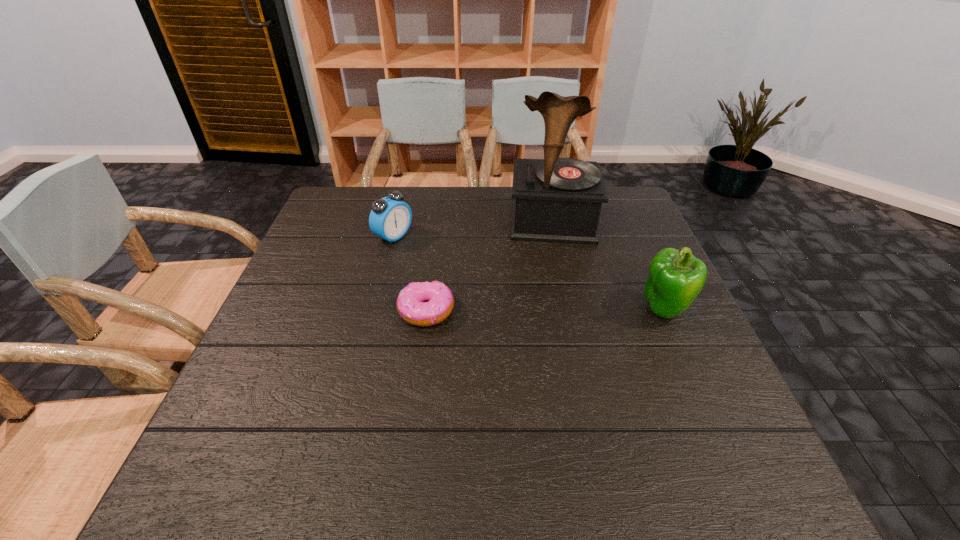
This screenshot has width=960, height=540. Find the location of `free space between the alarm clock and the tallest object`. free space between the alarm clock and the tallest object is located at coordinates (473, 230).

The width and height of the screenshot is (960, 540). I want to click on blank region between the rightmost object and the alarm clock, so click(x=529, y=272).

In order to click on unoccupied position between the phonograph_record and the alarm clock in this screenshot , I will do `click(473, 230)`.

The height and width of the screenshot is (540, 960). Identify the location of free point between the doughnut and the bell pepper. (545, 310).

The image size is (960, 540). In order to click on free point between the shortest object and the alarm clock in this screenshot , I will do `click(410, 274)`.

This screenshot has width=960, height=540. In order to click on vacant point located between the second object from right to left and the shortest object in this screenshot , I will do `click(490, 267)`.

Where is `object that is the second closest one to the shortest object`? object that is the second closest one to the shortest object is located at coordinates (559, 200).

Point out which object is positioned as the third nearest to the doughnut. Please provide its 2D coordinates. Your answer should be formatted as a tuple, i.e. [(x, y)], where the tuple contains the x and y coordinates of a point satisfying the conditions above.

[(675, 278)]

The height and width of the screenshot is (540, 960). What are the coordinates of `free space that satisfies the following two spatial constraints: 1. on the back side of the tallest object; 2. on the left side of the doughnut` in the screenshot? It's located at (438, 222).